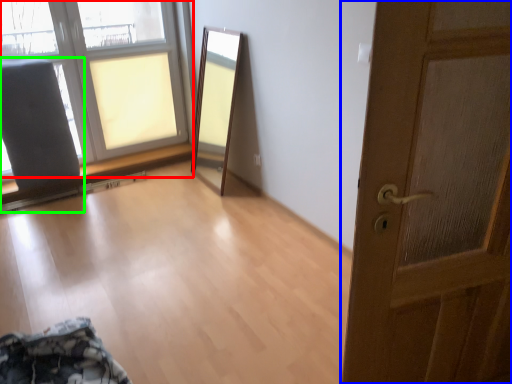
Question: Based on their relative distances, which object is farther from window (highlighted by a red box)? Choose from door (highlighted by a blue box) and armchair (highlighted by a green box).

Choices:
 (A) door
 (B) armchair

Answer: (A)